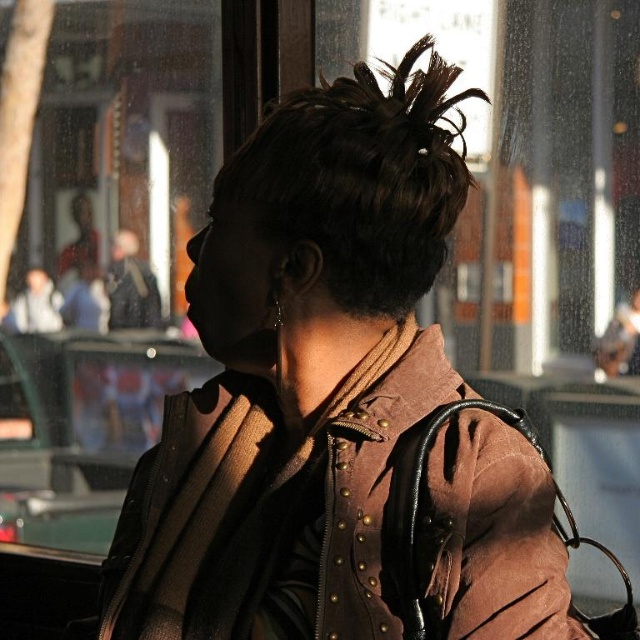
You are standing at point [378,273] and want to move to point [394,305]. Is the destination behind you?

Yes, point [394,305] is behind point [378,273], so the destination is behind you.

You are a fashion designer observing a person wearing a brown suede jacket at center and having dark brown hair at upper center. Which item is bigger in size?

The brown suede jacket at center has a larger size compared to the dark brown hair at upper center.

You are an artist trying to sketch this scene. To ensure accuracy, you need to know the exact position of the brown suede jacket at center. Can you tell me its coordinates?

The brown suede jacket at center is located at coordinates 0.583 on the x axis and 0.467 on the y axis.